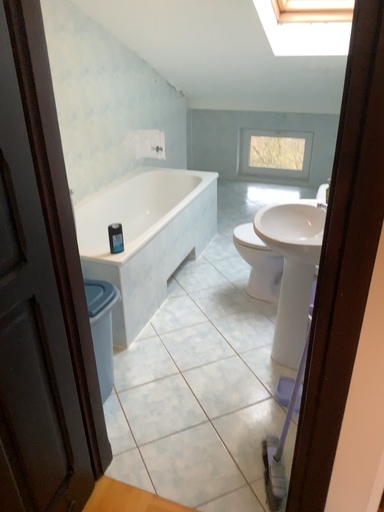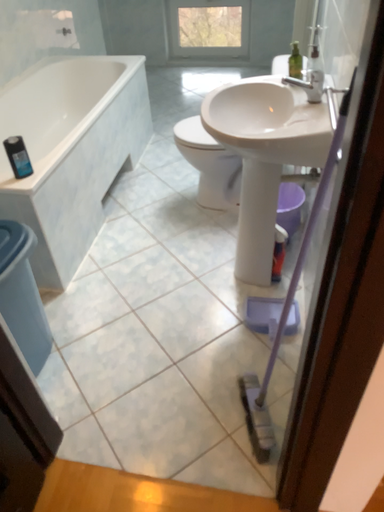
Question: How did the camera likely rotate when shooting the video?

Choices:
 (A) rotated right
 (B) rotated left

Answer: (A)